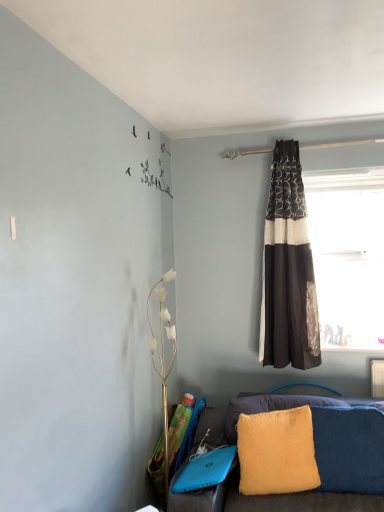
Question: Is transparent glass window at upper right to the left or to the right of fuzzy yellow pillow at lower right in the image?

Choices:
 (A) right
 (B) left

Answer: (A)

Question: In terms of width, does transparent glass window at upper right look wider or thinner when compared to fuzzy yellow pillow at lower right?

Choices:
 (A) wide
 (B) thin

Answer: (B)

Question: Which of these objects is positioned closest to the black textured curtain at right?

Choices:
 (A) fuzzy yellow pillow at lower right
 (B) transparent glass window at upper right

Answer: (B)

Question: Considering the real-world distances, which object is closest to the fuzzy yellow pillow at lower right?

Choices:
 (A) black textured curtain at right
 (B) transparent glass window at upper right

Answer: (A)